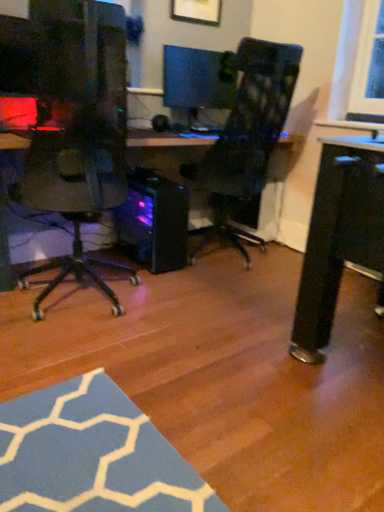
Question: Should I look upward or downward to see matte black monitor at center?

Choices:
 (A) up
 (B) down

Answer: (A)

Question: From a real-world perspective, is matte black monitor at center beneath transparent plastic computer tower at center?

Choices:
 (A) no
 (B) yes

Answer: (A)

Question: Is matte black monitor at center oriented towards transparent plastic computer tower at center?

Choices:
 (A) yes
 (B) no

Answer: (B)

Question: Considering the relative sizes of matte black monitor at center and transparent plastic computer tower at center in the image provided, is matte black monitor at center taller than transparent plastic computer tower at center?

Choices:
 (A) no
 (B) yes

Answer: (A)

Question: Can you confirm if matte black monitor at center is shorter than transparent plastic computer tower at center?

Choices:
 (A) no
 (B) yes

Answer: (B)

Question: From a real-world perspective, is matte black monitor at center positioned over transparent plastic computer tower at center based on gravity?

Choices:
 (A) yes
 (B) no

Answer: (A)

Question: From the image's perspective, is matte black monitor at center on transparent plastic computer tower at center?

Choices:
 (A) yes
 (B) no

Answer: (A)

Question: From a real-world perspective, is transparent plastic computer tower at center located beneath matte black monitor at center?

Choices:
 (A) yes
 (B) no

Answer: (A)

Question: Can you confirm if transparent plastic computer tower at center is wider than matte black monitor at center?

Choices:
 (A) yes
 (B) no

Answer: (A)

Question: Can you confirm if transparent plastic computer tower at center is positioned to the left of matte black monitor at center?

Choices:
 (A) no
 (B) yes

Answer: (B)

Question: Is transparent plastic computer tower at center behind matte black monitor at center?

Choices:
 (A) no
 (B) yes

Answer: (A)

Question: From a real-world perspective, does transparent plastic computer tower at center stand above matte black monitor at center?

Choices:
 (A) yes
 (B) no

Answer: (B)

Question: Is transparent plastic computer tower at center not within matte black monitor at center?

Choices:
 (A) no
 (B) yes

Answer: (B)

Question: Considering the positions of matte black monitor at center and transparent plastic computer tower at center in the image, is matte black monitor at center bigger or smaller than transparent plastic computer tower at center?

Choices:
 (A) big
 (B) small

Answer: (B)